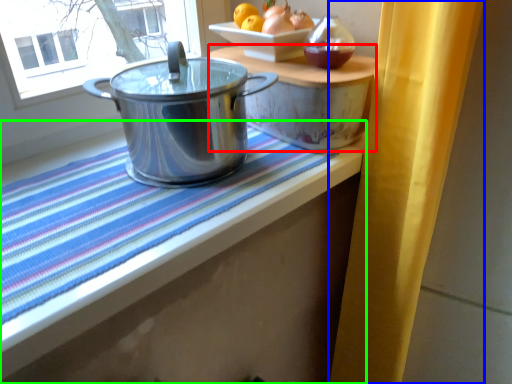
Question: Based on their relative distances, which object is nearer to table (highlighted by a red box)? Choose from curtain (highlighted by a blue box) and table (highlighted by a green box).

Choices:
 (A) curtain
 (B) table

Answer: (A)